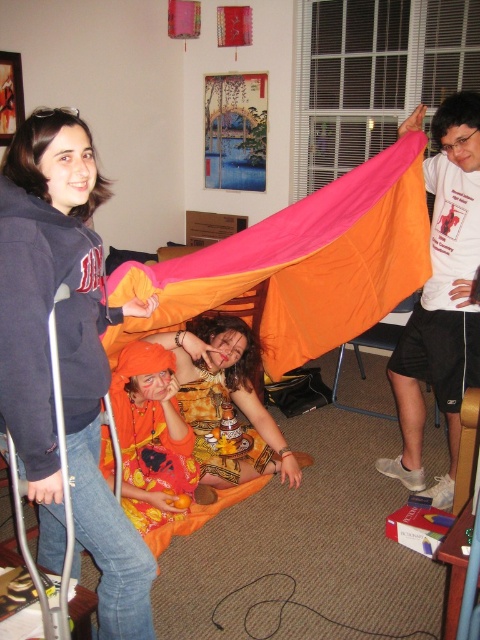
You are standing in the room and want to hand a snack to the person inside the pink fabric tent at center. The person is holding a small object. Do you need to walk around the matte black hoodie at left to reach the tent?

The matte black hoodie at left is closer to the viewer than the pink fabric tent at center, so you would need to walk around the matte black hoodie at left to reach the pink fabric tent at center.